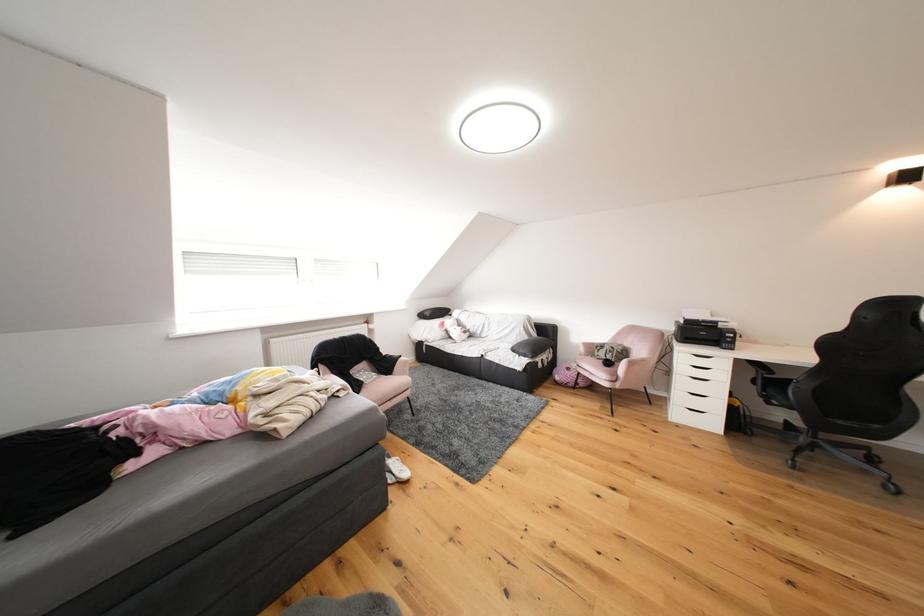
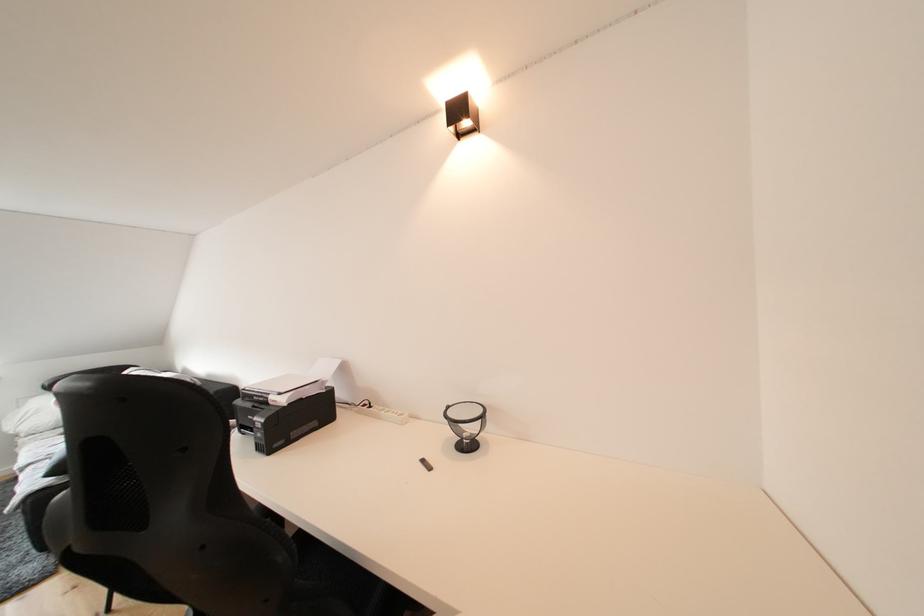
Question: The images are taken continuously from a first-person perspective. In which direction are you moving?

Choices:
 (A) Left
 (B) Right
 (C) Forward
 (D) Backward

Answer: (B)